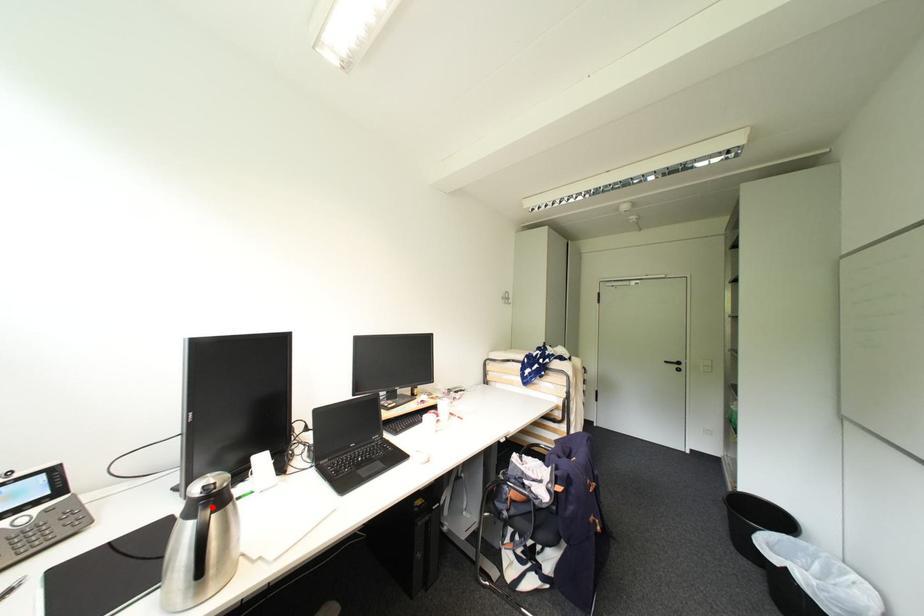
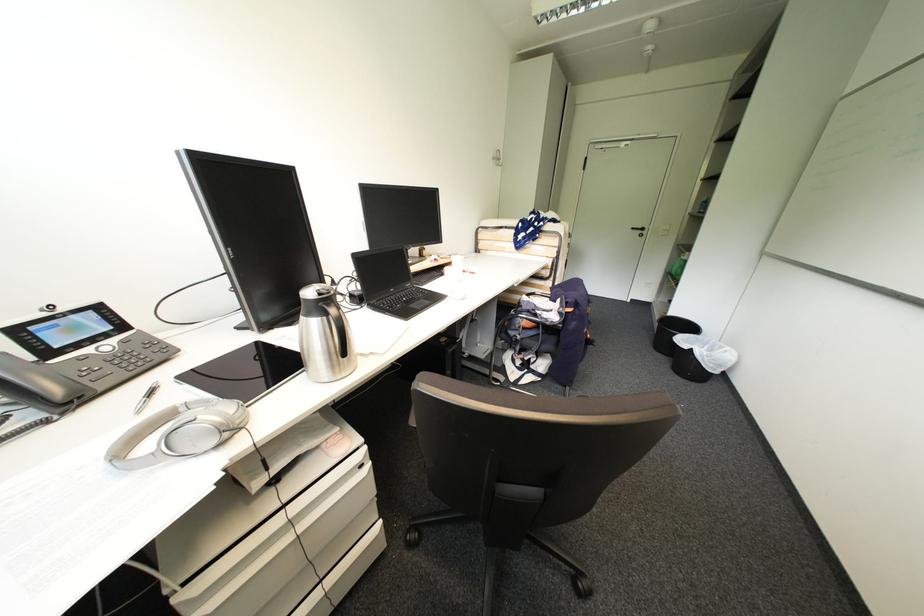
The point at the highlighted location is marked in the first image. Where is the corresponding point in the second image?

(334, 306)